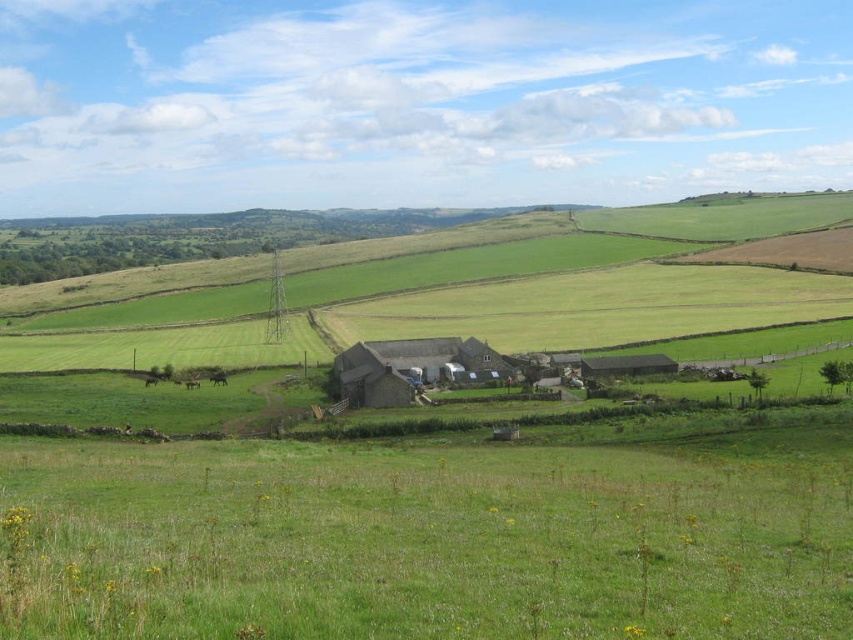
This screenshot has height=640, width=853. Describe the element at coordinates (425, 540) in the screenshot. I see `green grassy field at lower center` at that location.

Can you confirm if green grassy field at lower center is taller than stone barn at center?

No.

Does point (175, 564) come behind point (404, 360)?

No, (175, 564) is closer to viewer.

Locate an element on the screen. The width and height of the screenshot is (853, 640). green grassy field at lower center is located at coordinates (425, 540).

Which is more to the right, stone barn at center or dark gray stone barn at center?

dark gray stone barn at center is more to the right.

Is stone barn at center above dark gray stone barn at center?

No.

I want to click on stone barn at center, so click(412, 369).

Does green grassy field at lower center lie behind dark gray stone barn at center?

No.

Which is behind, point (749, 630) or point (625, 376)?

The point (625, 376) is more distant.

Measure the distance between green grassy field at lower center and camera.

19.53 meters

The image size is (853, 640). Identify the location of green grassy field at lower center. (425, 540).